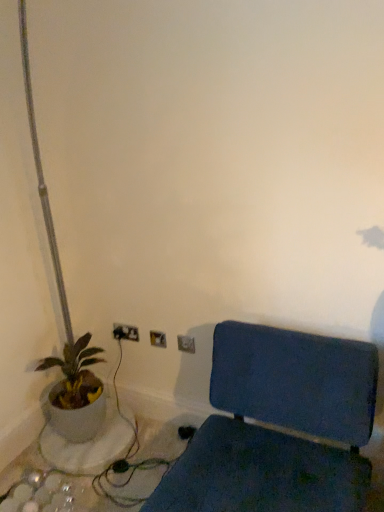
Locate an element on the screen. The height and width of the screenshot is (512, 384). matte white pot at left is located at coordinates (76, 392).

Locate an element on the screen. The image size is (384, 512). metallic silver electric outlet at lower center, the third electric outlet in the front-to-back sequence is located at coordinates (125, 332).

The height and width of the screenshot is (512, 384). Describe the element at coordinates (125, 332) in the screenshot. I see `metallic silver electric outlet at lower center, the third electric outlet in the front-to-back sequence` at that location.

Identify the location of metallic silver electric outlet at upper center, arranged as the first electric outlet when viewed from the right. This screenshot has height=512, width=384. (186, 344).

Is metallic silver electric outlet at lower center, which is the 3th electric outlet in right-to-left order, in contact with blue fabric chair at lower right?

No, metallic silver electric outlet at lower center, which is the 3th electric outlet in right-to-left order, is not beside blue fabric chair at lower right.

From a real-world perspective, which is physically below, metallic silver electric outlet at lower center, placed as the 1th electric outlet when sorted from back to front, or blue fabric chair at lower right?

From a 3D spatial view, blue fabric chair at lower right is below.

How different are the orientations of metallic silver electric outlet at lower center, placed as the 1th electric outlet when sorted from back to front, and blue fabric chair at lower right in degrees?

There is a 4.14-degree angle between the facing directions of metallic silver electric outlet at lower center, placed as the 1th electric outlet when sorted from back to front, and blue fabric chair at lower right.

Is point (328, 341) farther from camera compared to point (137, 341)?

No.

Considering their positions, is blue fabric chair at lower right located in front of or behind metallic silver electric outlet at lower center, placed as the 1th electric outlet when sorted from back to front?

blue fabric chair at lower right is in front of metallic silver electric outlet at lower center, placed as the 1th electric outlet when sorted from back to front.

Could you tell me if blue fabric chair at lower right is turned towards metallic silver electric outlet at lower center, which is the 3th electric outlet in right-to-left order?

No, blue fabric chair at lower right is not oriented towards metallic silver electric outlet at lower center, which is the 3th electric outlet in right-to-left order.

Which of these two, blue fabric chair at lower right or metallic silver electric outlet at lower center, which is the 3th electric outlet in right-to-left order, stands taller?

blue fabric chair at lower right.

Would you say blue fabric chair at lower right is to the left or to the right of metallic silver electric outlet at upper center, arranged as the first electric outlet when viewed from the right, in the picture?

From the image, it's evident that blue fabric chair at lower right is to the right of metallic silver electric outlet at upper center, arranged as the first electric outlet when viewed from the right.

Looking at the image, does blue fabric chair at lower right seem bigger or smaller compared to metallic silver electric outlet at upper center, the third electric outlet when ordered from back to front?

Considering their sizes, blue fabric chair at lower right takes up more space than metallic silver electric outlet at upper center, the third electric outlet when ordered from back to front.

Based on the photo, could you measure the distance between blue fabric chair at lower right and metallic silver electric outlet at upper center, the third electric outlet when ordered from back to front?

A distance of 24.32 inches exists between blue fabric chair at lower right and metallic silver electric outlet at upper center, the third electric outlet when ordered from back to front.

Which of these two, blue fabric chair at lower right or metallic silver electric outlet at upper center, acting as the 1th electric outlet starting from the front, stands shorter?

With less height is metallic silver electric outlet at upper center, acting as the 1th electric outlet starting from the front.

Is matte white pot at left bigger than metallic silver electric outlet at lower center, the third electric outlet in the front-to-back sequence?

Yes, matte white pot at left is bigger than metallic silver electric outlet at lower center, the third electric outlet in the front-to-back sequence.

Is matte white pot at left turned away from metallic silver electric outlet at lower center, which is the 3th electric outlet in right-to-left order?

That's not correct — matte white pot at left is not looking away from metallic silver electric outlet at lower center, which is the 3th electric outlet in right-to-left order.

How many degrees apart are the facing directions of matte white pot at left and metallic silver electric outlet at lower center, placed as the 1th electric outlet when sorted from back to front?

There is a 83.5-degree angle between the facing directions of matte white pot at left and metallic silver electric outlet at lower center, placed as the 1th electric outlet when sorted from back to front.

Is matte white pot at left thinner than metallic silver electric outlet at lower center, the 1th electric outlet in the left-to-right sequence?

No, matte white pot at left is not thinner than metallic silver electric outlet at lower center, the 1th electric outlet in the left-to-right sequence.

The image size is (384, 512). I want to click on furniture above the matte white pot at left (from a real-world perspective), so click(279, 425).

Is blue fabric chair at lower right oriented towards matte white pot at left?

No, blue fabric chair at lower right is not oriented towards matte white pot at left.

Is the surface of blue fabric chair at lower right in direct contact with matte white pot at left?

No, blue fabric chair at lower right is not beside matte white pot at left.

Is blue fabric chair at lower right thinner than metallic silver electric outlet at center, placed as the 2th electric outlet when sorted from left to right?

Incorrect, the width of blue fabric chair at lower right is not less than that of metallic silver electric outlet at center, placed as the 2th electric outlet when sorted from left to right.

Considering the positions of point (238, 396) and point (155, 346), is point (238, 396) closer or farther from the camera than point (155, 346)?

Point (238, 396) appears to be closer to the viewer than point (155, 346).

Which object is more forward, blue fabric chair at lower right or metallic silver electric outlet at center, acting as the second electric outlet starting from the right?

blue fabric chair at lower right is in front.

How distant is blue fabric chair at lower right from metallic silver electric outlet at center, which is the second electric outlet in front-to-back order?

They are 29.20 inches apart.

Does metallic silver electric outlet at lower center, placed as the 1th electric outlet when sorted from back to front, have a larger size compared to metallic silver electric outlet at center, which is the second electric outlet in front-to-back order?

Yes.

Considering the sizes of objects metallic silver electric outlet at lower center, which is the 3th electric outlet in right-to-left order, and metallic silver electric outlet at center, which is the second electric outlet in front-to-back order, in the image provided, who is taller, metallic silver electric outlet at lower center, which is the 3th electric outlet in right-to-left order, or metallic silver electric outlet at center, which is the second electric outlet in front-to-back order,?

metallic silver electric outlet at center, which is the second electric outlet in front-to-back order, is taller.

From a real-world perspective, is metallic silver electric outlet at lower center, the 1th electric outlet in the left-to-right sequence, located higher than metallic silver electric outlet at center, the second electric outlet positioned from the back?

Yes, from a real-world perspective, metallic silver electric outlet at lower center, the 1th electric outlet in the left-to-right sequence, is over metallic silver electric outlet at center, the second electric outlet positioned from the back

Is metallic silver electric outlet at lower center, placed as the 1th electric outlet when sorted from back to front, positioned with its back to metallic silver electric outlet at center, acting as the second electric outlet starting from the right?

No, metallic silver electric outlet at center, acting as the second electric outlet starting from the right, is not at the back of metallic silver electric outlet at lower center, placed as the 1th electric outlet when sorted from back to front.

Where is `furniture lying in front of the metallic silver electric outlet at lower center, placed as the 1th electric outlet when sorted from back to front`? furniture lying in front of the metallic silver electric outlet at lower center, placed as the 1th electric outlet when sorted from back to front is located at coordinates (279, 425).

This screenshot has height=512, width=384. In order to click on furniture below the metallic silver electric outlet at lower center, the 1th electric outlet in the left-to-right sequence (from the image's perspective) in this screenshot , I will do `click(279, 425)`.

In the scene shown: From the image, which object appears to be nearer to metallic silver electric outlet at center, placed as the 2th electric outlet when sorted from left to right, metallic silver electric outlet at lower center, placed as the 1th electric outlet when sorted from back to front, or blue fabric chair at lower right?

The object closer to metallic silver electric outlet at center, placed as the 2th electric outlet when sorted from left to right, is metallic silver electric outlet at lower center, placed as the 1th electric outlet when sorted from back to front.

From the image, which object appears to be nearer to metallic silver electric outlet at lower center, placed as the 1th electric outlet when sorted from back to front, metallic silver electric outlet at center, placed as the 2th electric outlet when sorted from left to right, or matte white pot at left?

Among the two, metallic silver electric outlet at center, placed as the 2th electric outlet when sorted from left to right, is located nearer to metallic silver electric outlet at lower center, placed as the 1th electric outlet when sorted from back to front.

Based on their spatial positions, is matte white pot at left or blue fabric chair at lower right closer to metallic silver electric outlet at center, which is the second electric outlet in front-to-back order?

Based on the image, matte white pot at left appears to be nearer to metallic silver electric outlet at center, which is the second electric outlet in front-to-back order.

Based on their spatial positions, is metallic silver electric outlet at lower center, placed as the 1th electric outlet when sorted from back to front, or blue fabric chair at lower right further from metallic silver electric outlet at upper center, which is the 3th electric outlet in left-to-right order?

blue fabric chair at lower right is further to metallic silver electric outlet at upper center, which is the 3th electric outlet in left-to-right order.

Which object lies further to the anchor point blue fabric chair at lower right, metallic silver electric outlet at center, which is the second electric outlet in front-to-back order, or metallic silver electric outlet at upper center, arranged as the first electric outlet when viewed from the right?

metallic silver electric outlet at center, which is the second electric outlet in front-to-back order, is positioned further to the anchor blue fabric chair at lower right.

Considering their positions, is metallic silver electric outlet at upper center, the third electric outlet when ordered from back to front, positioned closer to metallic silver electric outlet at center, the second electric outlet positioned from the back, than matte white pot at left?

metallic silver electric outlet at upper center, the third electric outlet when ordered from back to front, lies closer to metallic silver electric outlet at center, the second electric outlet positioned from the back, than the other object.

Looking at the image, which one is located further to matte white pot at left, metallic silver electric outlet at upper center, arranged as the first electric outlet when viewed from the right, or blue fabric chair at lower right?

blue fabric chair at lower right is positioned further to the anchor matte white pot at left.

Looking at the image, which one is located closer to metallic silver electric outlet at upper center, the third electric outlet when ordered from back to front, blue fabric chair at lower right or metallic silver electric outlet at center, the second electric outlet positioned from the back?

Among the two, metallic silver electric outlet at center, the second electric outlet positioned from the back, is located nearer to metallic silver electric outlet at upper center, the third electric outlet when ordered from back to front.

Where is `electric outlet between metallic silver electric outlet at lower center, the third electric outlet in the front-to-back sequence, and metallic silver electric outlet at upper center, acting as the 1th electric outlet starting from the front, in the horizontal direction`? electric outlet between metallic silver electric outlet at lower center, the third electric outlet in the front-to-back sequence, and metallic silver electric outlet at upper center, acting as the 1th electric outlet starting from the front, in the horizontal direction is located at coordinates coord(158,339).

Image resolution: width=384 pixels, height=512 pixels. Find the location of `electric outlet located between blue fabric chair at lower right and metallic silver electric outlet at center, placed as the 2th electric outlet when sorted from left to right, in the depth direction`. electric outlet located between blue fabric chair at lower right and metallic silver electric outlet at center, placed as the 2th electric outlet when sorted from left to right, in the depth direction is located at coordinates click(x=186, y=344).

Identify the location of houseplant between blue fabric chair at lower right and metallic silver electric outlet at lower center, the 1th electric outlet in the left-to-right sequence, in the front-back direction. (76, 392).

Where is `houseplant positioned between blue fabric chair at lower right and metallic silver electric outlet at upper center, which is the 3th electric outlet in left-to-right order, from near to far`? Image resolution: width=384 pixels, height=512 pixels. houseplant positioned between blue fabric chair at lower right and metallic silver electric outlet at upper center, which is the 3th electric outlet in left-to-right order, from near to far is located at coordinates (76, 392).